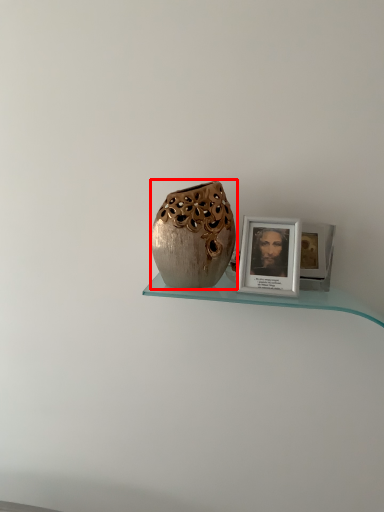
Question: Considering the relative positions of vase (annotated by the red box) and picture frame in the image provided, where is vase (annotated by the red box) located with respect to the staircase?

Choices:
 (A) right
 (B) left

Answer: (B)